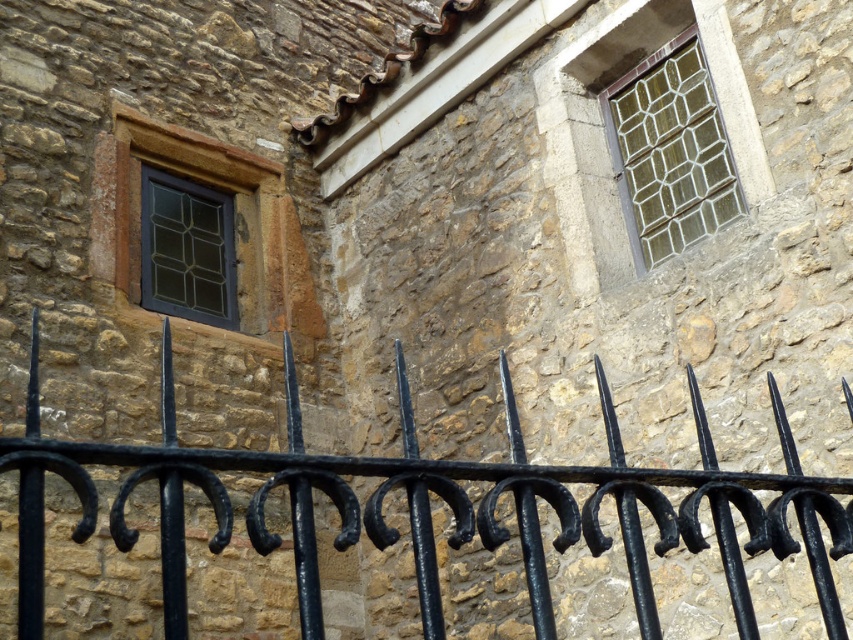
Question: Is black wrought iron fence at upper center thinner than matte glass window at upper left?

Choices:
 (A) yes
 (B) no

Answer: (B)

Question: Is black wrought iron fence at upper center thinner than matte black window at upper left?

Choices:
 (A) yes
 (B) no

Answer: (B)

Question: Is black wrought iron fence at upper center to the left of matte glass window at upper left from the viewer's perspective?

Choices:
 (A) yes
 (B) no

Answer: (B)

Question: Which object appears closest to the camera in this image?

Choices:
 (A) matte glass window at upper left
 (B) black wrought iron fence at upper center
 (C) matte black window at upper left
 (D) stained glass window at upper right

Answer: (B)

Question: Which point is farther to the camera?

Choices:
 (A) stained glass window at upper right
 (B) matte glass window at upper left
 (C) matte black window at upper left
 (D) black wrought iron fence at upper center

Answer: (C)

Question: Which object is positioned closest to the matte glass window at upper left?

Choices:
 (A) black wrought iron fence at upper center
 (B) matte black window at upper left
 (C) stained glass window at upper right

Answer: (B)